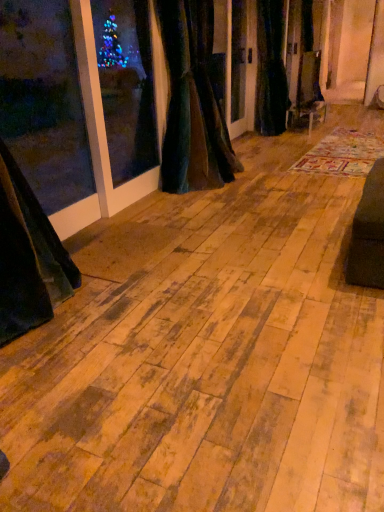
Question: Is multicolored woven rug at center oriented away from velvet dark green curtain at center, marked as the second curtain in a front-to-back arrangement?

Choices:
 (A) no
 (B) yes

Answer: (A)

Question: Does multicolored woven rug at center appear on the right side of velvet dark green curtain at center, which ranks as the 1th curtain in right-to-left order?

Choices:
 (A) no
 (B) yes

Answer: (B)

Question: Does multicolored woven rug at center appear on the left side of velvet dark green curtain at center, marked as the second curtain in a front-to-back arrangement?

Choices:
 (A) no
 (B) yes

Answer: (A)

Question: Considering the relative positions of multicolored woven rug at center and velvet dark green curtain at center, the 1th curtain in the back-to-front sequence, in the image provided, is multicolored woven rug at center in front of velvet dark green curtain at center, the 1th curtain in the back-to-front sequence,?

Choices:
 (A) yes
 (B) no

Answer: (A)

Question: From the image's perspective, is multicolored woven rug at center on velvet dark green curtain at center, the 1th curtain in the back-to-front sequence?

Choices:
 (A) yes
 (B) no

Answer: (B)

Question: Visually, is velvet dark green curtain at center, the 1th curtain in the back-to-front sequence, positioned to the left or to the right of multicolored woven rug at center?

Choices:
 (A) right
 (B) left

Answer: (B)

Question: From a real-world perspective, relative to multicolored woven rug at center, is velvet dark green curtain at center, which is the second curtain in left-to-right order, vertically above or below?

Choices:
 (A) below
 (B) above

Answer: (B)

Question: Considering the positions of velvet dark green curtain at center, which ranks as the 1th curtain in right-to-left order, and multicolored woven rug at center in the image, is velvet dark green curtain at center, which ranks as the 1th curtain in right-to-left order, wider or thinner than multicolored woven rug at center?

Choices:
 (A) wide
 (B) thin

Answer: (B)

Question: Considering the positions of velvet dark green curtain at center, which ranks as the 1th curtain in right-to-left order, and multicolored woven rug at center in the image, is velvet dark green curtain at center, which ranks as the 1th curtain in right-to-left order, taller or shorter than multicolored woven rug at center?

Choices:
 (A) short
 (B) tall

Answer: (B)

Question: In the image, is velvet dark green curtain at center, the 1th curtain when ordered from left to right, positioned in front of or behind velvet dark green curtain at center, marked as the second curtain in a front-to-back arrangement?

Choices:
 (A) front
 (B) behind

Answer: (A)

Question: In terms of size, does velvet dark green curtain at center, which is counted as the 2th curtain, starting from the back, appear bigger or smaller than velvet dark green curtain at center, which is the second curtain in left-to-right order?

Choices:
 (A) big
 (B) small

Answer: (A)

Question: Which is correct: velvet dark green curtain at center, which is the 1th curtain from front to back, is inside velvet dark green curtain at center, which is the second curtain in left-to-right order, or outside of it?

Choices:
 (A) outside
 (B) inside

Answer: (A)

Question: From the image's perspective, is velvet dark green curtain at center, which is counted as the 2th curtain, starting from the back, located above or below velvet dark green curtain at center, marked as the second curtain in a front-to-back arrangement?

Choices:
 (A) below
 (B) above

Answer: (A)

Question: Is multicolored woven rug at center inside or outside of velvet dark green curtain at center, which is counted as the 2th curtain, starting from the back?

Choices:
 (A) outside
 (B) inside

Answer: (A)

Question: Considering their positions, is multicolored woven rug at center located in front of or behind velvet dark green curtain at center, the 1th curtain when ordered from left to right?

Choices:
 (A) front
 (B) behind

Answer: (B)